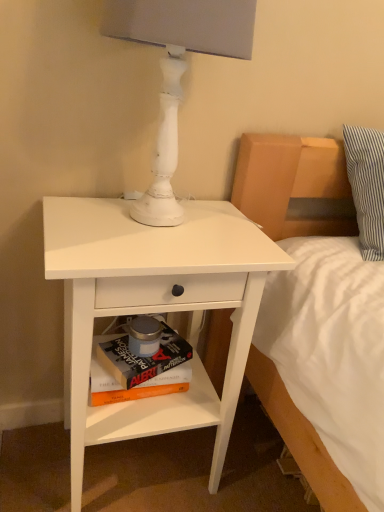
Locate an element on the screen. The height and width of the screenshot is (512, 384). empty space that is ontop of white matte nightstand at lower left (from a real-world perspective) is located at coordinates (120, 221).